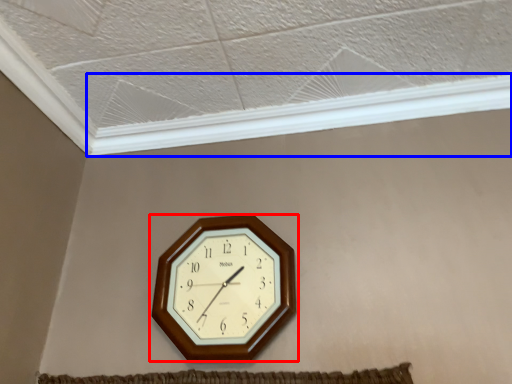
Question: Which of the following is the closest to the observer, wall clock (highlighted by a red box) or window frame (highlighted by a blue box)?

Choices:
 (A) wall clock
 (B) window frame

Answer: (A)